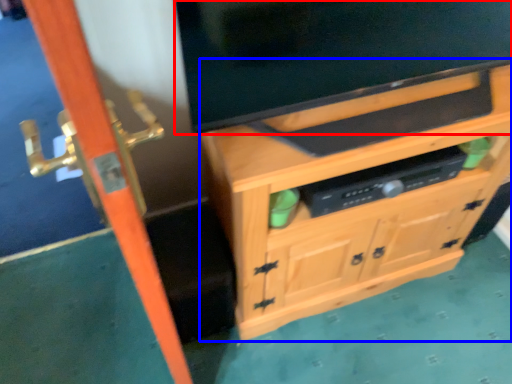
Question: Which point is further to the camera, television (highlighted by a red box) or cabinetry (highlighted by a blue box)?

Choices:
 (A) television
 (B) cabinetry

Answer: (B)